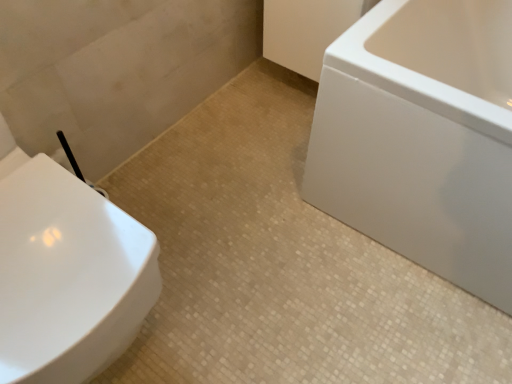
Identify the location of vacant point above beige mosaic tile at center (from a real-world perspective). Image resolution: width=512 pixels, height=384 pixels. (280, 258).